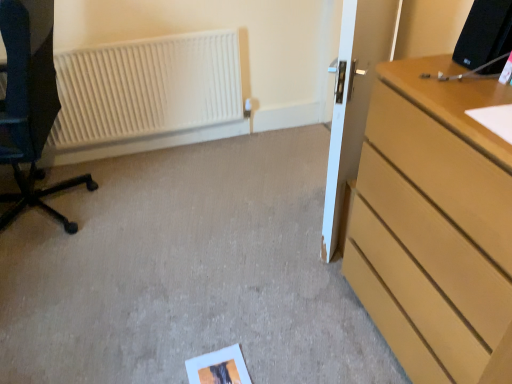
What do you see at coordinates (354, 99) in the screenshot? I see `white glossy door at center` at bounding box center [354, 99].

Identify the location of light wood dresser at right. This screenshot has height=384, width=512. 435,225.

Find the location of a particular element. This screenshot has height=384, width=512. matte black chair at left is located at coordinates (30, 103).

Image resolution: width=512 pixels, height=384 pixels. Describe the element at coordinates (30, 103) in the screenshot. I see `matte black chair at left` at that location.

The height and width of the screenshot is (384, 512). Find the location of `white matte radiator at upper left`. white matte radiator at upper left is located at coordinates (146, 89).

Locate an element on the screen. white glossy door at center is located at coordinates (354, 99).

Is light wood dresser at right facing away from white glossy door at center?

No, light wood dresser at right's orientation is not away from white glossy door at center.

From the image's perspective, between light wood dresser at right and white glossy door at center, who is located below?

light wood dresser at right.

Consider the image. Would you say light wood dresser at right is outside white glossy door at center?

That's correct, light wood dresser at right is outside of white glossy door at center.

Does point (39, 102) come in front of point (441, 106)?

No, it is behind (441, 106).

Which is more to the left, matte black chair at left or light wood dresser at right?

From the viewer's perspective, matte black chair at left appears more on the left side.

Is the surface of matte black chair at left in direct contact with light wood dresser at right?

They are not placed beside each other.

In the scene shown: Can you confirm if white glossy door at center is positioned to the left of light wood dresser at right?

Indeed, white glossy door at center is positioned on the left side of light wood dresser at right.

From the image's perspective, is white glossy door at center located beneath light wood dresser at right?

Actually, white glossy door at center appears above light wood dresser at right in the image.

Locate an element on the screen. chest of drawers below the white glossy door at center (from the image's perspective) is located at coordinates pyautogui.click(x=435, y=225).

Could you tell me if white glossy door at center is turned towards light wood dresser at right?

No, white glossy door at center does not turn towards light wood dresser at right.

Which is closer to the camera, (4, 202) or (365, 75)?

The point (365, 75) is more forward.

Locate an element on the screen. door on the right of matte black chair at left is located at coordinates (354, 99).

Is matte black chair at left bigger than white glossy door at center?

Yes.

From a real-world perspective, which object stands above the other?

From a 3D spatial view, matte black chair at left is above.

Considering the relative sizes of white matte radiator at upper left and white glossy door at center in the image provided, is white matte radiator at upper left taller than white glossy door at center?

No, white matte radiator at upper left is not taller than white glossy door at center.

Based on the photo, can you confirm if white matte radiator at upper left is wider than white glossy door at center?

No, white matte radiator at upper left is not wider than white glossy door at center.

From the image's perspective, is white matte radiator at upper left on top of white glossy door at center?

Yes, from the image's perspective, white matte radiator at upper left is over white glossy door at center.

Is white matte radiator at upper left directly adjacent to white glossy door at center?

No, white matte radiator at upper left is not beside white glossy door at center.

From a real-world perspective, is white glossy door at center located higher than white matte radiator at upper left?

Yes, from a real-world perspective, white glossy door at center is over white matte radiator at upper left

Does point (362, 14) appear closer or farther from the camera than point (210, 71)?

Point (362, 14).

I want to click on door that is in front of the white matte radiator at upper left, so click(354, 99).

Which of these two, white glossy door at center or white matte radiator at upper left, stands shorter?

With less height is white matte radiator at upper left.

Is light wood dresser at right spatially inside matte black chair at left, or outside of it?

light wood dresser at right is not inside matte black chair at left, it's outside.

Is light wood dresser at right positioned with its back to matte black chair at left?

No, matte black chair at left is not at the back of light wood dresser at right.

Which object is closer to the camera, light wood dresser at right or matte black chair at left?

light wood dresser at right is in front.

Is light wood dresser at right placed right next to matte black chair at left?

light wood dresser at right is not next to matte black chair at left, and they're not touching.

Identify the location of door that appears on the left of light wood dresser at right. (354, 99).

Identify the location of the chest of drawers that is below the matte black chair at left (from the image's perspective). The height and width of the screenshot is (384, 512). (435, 225).

Which object lies further to the anchor point white matte radiator at upper left, white glossy door at center or matte black chair at left?

white glossy door at center.

From the picture: Which object lies nearer to the anchor point white matte radiator at upper left, light wood dresser at right or matte black chair at left?

matte black chair at left is positioned closer to the anchor white matte radiator at upper left.

Based on the photo, based on their spatial positions, is matte black chair at left or light wood dresser at right closer to white matte radiator at upper left?

matte black chair at left.

Considering their positions, is matte black chair at left positioned closer to white matte radiator at upper left than white glossy door at center?

matte black chair at left is positioned closer to the anchor white matte radiator at upper left.

Considering their positions, is matte black chair at left positioned further to light wood dresser at right than white glossy door at center?

matte black chair at left.

Looking at the image, which one is located closer to matte black chair at left, white matte radiator at upper left or white glossy door at center?

white matte radiator at upper left.

Based on the photo, looking at the image, which one is located closer to matte black chair at left, white glossy door at center or white matte radiator at upper left?

white matte radiator at upper left is closer to matte black chair at left.

Looking at the image, which one is located further to white matte radiator at upper left, white glossy door at center or light wood dresser at right?

light wood dresser at right is positioned further to the anchor white matte radiator at upper left.

You are a GUI agent. You are given a task and a screenshot of the screen. Output one action in this format:
    pyautogui.click(x=<x>, y=<y>)
    Task: Click on the door between white matte radiator at upper left and light wood dresser at right from left to right
    The width and height of the screenshot is (512, 384).
    Given the screenshot: What is the action you would take?
    pyautogui.click(x=354, y=99)

Find the location of `radiator between matte black chair at left and white glossy door at center in the horizontal direction`. radiator between matte black chair at left and white glossy door at center in the horizontal direction is located at coordinates (146, 89).

The image size is (512, 384). I want to click on radiator between matte black chair at left and light wood dresser at right in the horizontal direction, so click(x=146, y=89).

The height and width of the screenshot is (384, 512). Find the location of `door located between matte black chair at left and light wood dresser at right in the left-right direction`. door located between matte black chair at left and light wood dresser at right in the left-right direction is located at coordinates (354, 99).